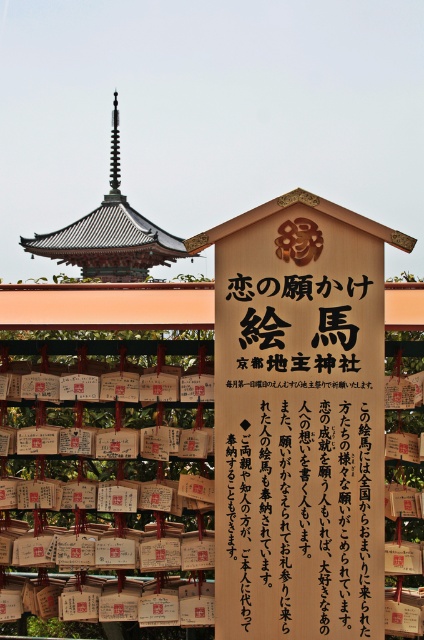
You are a visitor at the shrine and want to take a photo of the dark brown wooden pagoda at upper center without the wooden sign at center blocking the view. Is it possible to do so from your current position?

The wooden sign at center is in front of the dark brown wooden pagoda at upper center, so you cannot take a photo of the dark brown wooden pagoda at upper center without the wooden sign at center blocking the view from your current position.

You are standing at the torii gate at the Japanese shrine and want to take a photo of two specific points marked on the gate. The first point is at coordinates point [309,472] and the second point is at point [128,252]. Which point should you focus on first if you want to capture both points clearly in the same frame?

You should focus on point [309,472] first because it is closer to the camera than point [128,252], ensuring both points are in focus when using a camera with a fixed focal plane.